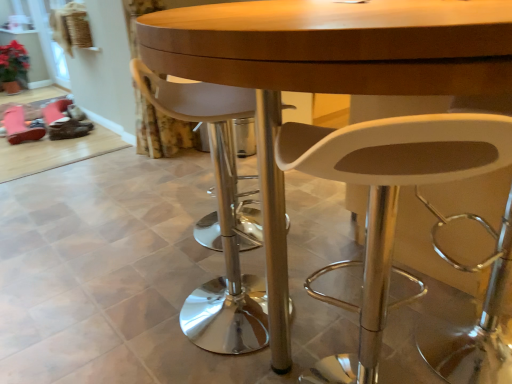
Question: Is white plastic chair at center, placed as the 1th chair when sorted from right to left, positioned with its back to pink suede shoe at lower left?

Choices:
 (A) no
 (B) yes

Answer: (A)

Question: Can you confirm if white plastic chair at center, placed as the 1th chair when sorted from right to left, is taller than pink suede shoe at lower left?

Choices:
 (A) no
 (B) yes

Answer: (B)

Question: Is pink suede shoe at lower left located within white plastic chair at center, which appears as the second chair when viewed from the left?

Choices:
 (A) yes
 (B) no

Answer: (B)

Question: Are white plastic chair at center, placed as the 1th chair when sorted from right to left, and pink suede shoe at lower left located far from each other?

Choices:
 (A) no
 (B) yes

Answer: (B)

Question: Does white plastic chair at center, placed as the 1th chair when sorted from right to left, turn towards pink suede shoe at lower left?

Choices:
 (A) yes
 (B) no

Answer: (B)

Question: Based on their sizes in the image, would you say pink suede shoe at lower left is bigger or smaller than transparent glass door at upper left?

Choices:
 (A) small
 (B) big

Answer: (A)

Question: Considering the positions of pink suede shoe at lower left and transparent glass door at upper left in the image, is pink suede shoe at lower left wider or thinner than transparent glass door at upper left?

Choices:
 (A) wide
 (B) thin

Answer: (A)

Question: From a real-world perspective, is pink suede shoe at lower left above or below transparent glass door at upper left?

Choices:
 (A) above
 (B) below

Answer: (B)

Question: Is pink suede shoe at lower left to the left or to the right of transparent glass door at upper left in the image?

Choices:
 (A) left
 (B) right

Answer: (B)

Question: Looking at the image, does matte wood table at center seem bigger or smaller compared to brown leather shoe at lower left?

Choices:
 (A) small
 (B) big

Answer: (B)

Question: Considering the positions of point (507, 72) and point (69, 137), is point (507, 72) closer or farther from the camera than point (69, 137)?

Choices:
 (A) closer
 (B) farther

Answer: (A)

Question: In terms of height, does matte wood table at center look taller or shorter compared to brown leather shoe at lower left?

Choices:
 (A) tall
 (B) short

Answer: (A)

Question: From the image's perspective, is matte wood table at center positioned above or below brown leather shoe at lower left?

Choices:
 (A) below
 (B) above

Answer: (A)

Question: From a real-world perspective, is transparent glass door at upper left positioned above or below white plastic chair at center, placed as the 1th chair when sorted from right to left?

Choices:
 (A) above
 (B) below

Answer: (A)

Question: Considering the positions of point pos(46,38) and point pos(505,162), is point pos(46,38) closer or farther from the camera than point pos(505,162)?

Choices:
 (A) farther
 (B) closer

Answer: (A)